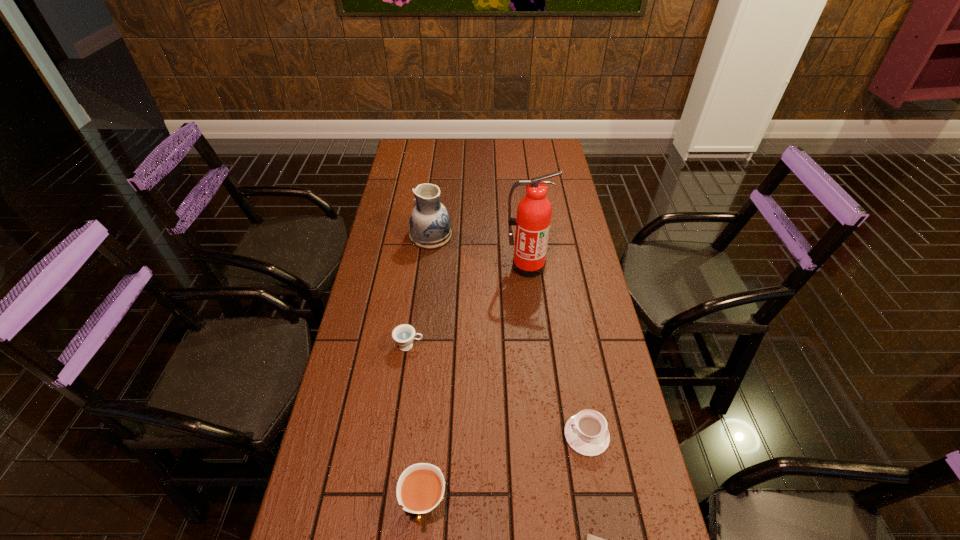
You are a GUI agent. You are given a task and a screenshot of the screen. Output one action in this format:
    pyautogui.click(x=<x>, y=<y>)
    Task: Click on the free spot located 0.220m on the back of the farthest object
    
    Given the screenshot: What is the action you would take?
    pyautogui.click(x=437, y=190)

Find the location of a particular element. The height and width of the screenshot is (540, 960). vacant space situated on the side of the farthest teacup with the handle is located at coordinates (534, 346).

The image size is (960, 540). Find the location of `vacant point located on the handle side of the rightmost teacup`. vacant point located on the handle side of the rightmost teacup is located at coordinates (455, 435).

I want to click on free space located 0.360m on the handle side of the rightmost teacup, so coord(420,435).

Where is `free spot located on the handle side of the rightmost teacup`? This screenshot has height=540, width=960. free spot located on the handle side of the rightmost teacup is located at coordinates (440, 435).

Where is `pottery that is at the left edge`? The image size is (960, 540). pottery that is at the left edge is located at coordinates (429, 222).

The width and height of the screenshot is (960, 540). I want to click on teacup present at the left edge, so click(404, 334).

The image size is (960, 540). I want to click on fire extinguisher that is at the right edge, so click(x=534, y=211).

You are a GUI agent. You are given a task and a screenshot of the screen. Output one action in this format:
    pyautogui.click(x=<x>, y=<y>)
    Task: Click on the teacup that is positioned at the right edge
    
    Given the screenshot: What is the action you would take?
    pyautogui.click(x=586, y=432)

The image size is (960, 540). In order to click on free region at the far edge of the desktop in this screenshot , I will do `click(499, 152)`.